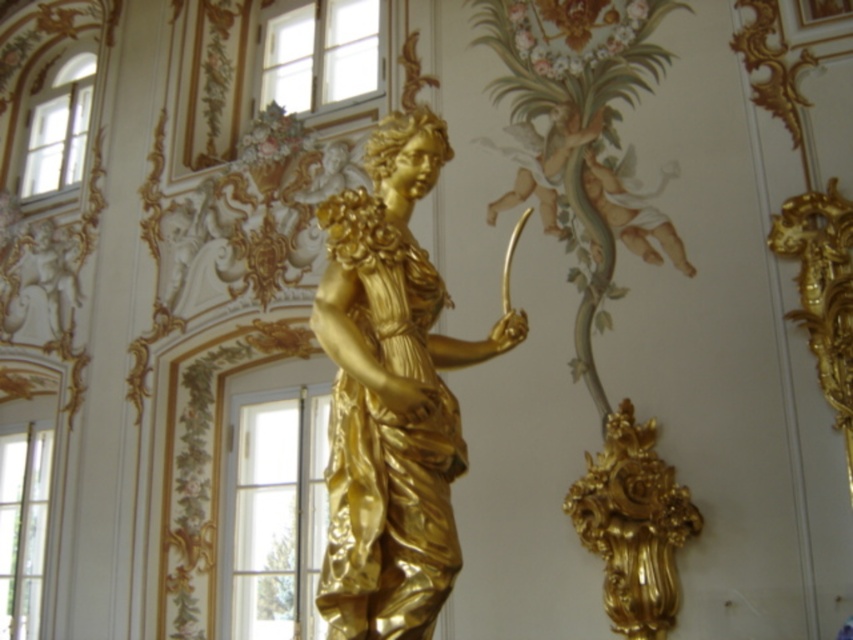
Question: Can you confirm if gold polished statue at center is wider than gold ornate vase at lower right?

Choices:
 (A) yes
 (B) no

Answer: (A)

Question: Does gold polished statue at center have a lesser width compared to gold ornate vase at lower right?

Choices:
 (A) yes
 (B) no

Answer: (B)

Question: Among these objects, which one is nearest to the camera?

Choices:
 (A) gold ornate vase at lower right
 (B) gold polished statue at center

Answer: (B)

Question: From the image, what is the correct spatial relationship of gold polished statue at center in relation to gold ornate vase at lower right?

Choices:
 (A) left
 (B) right

Answer: (A)

Question: Which point is closer to the camera?

Choices:
 (A) (387, 584)
 (B) (619, 493)

Answer: (A)